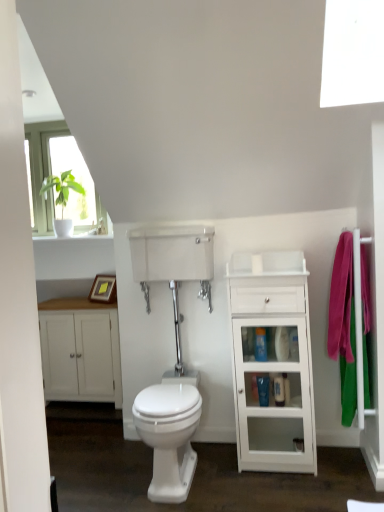
You are a GUI agent. You are given a task and a screenshot of the screen. Output one action in this format:
    pyautogui.click(x=<x>, y=<y>)
    Task: Click on the free space above white glossy bidet at center (from a real-world perspective)
    The height and width of the screenshot is (512, 384).
    Given the screenshot: What is the action you would take?
    166,393